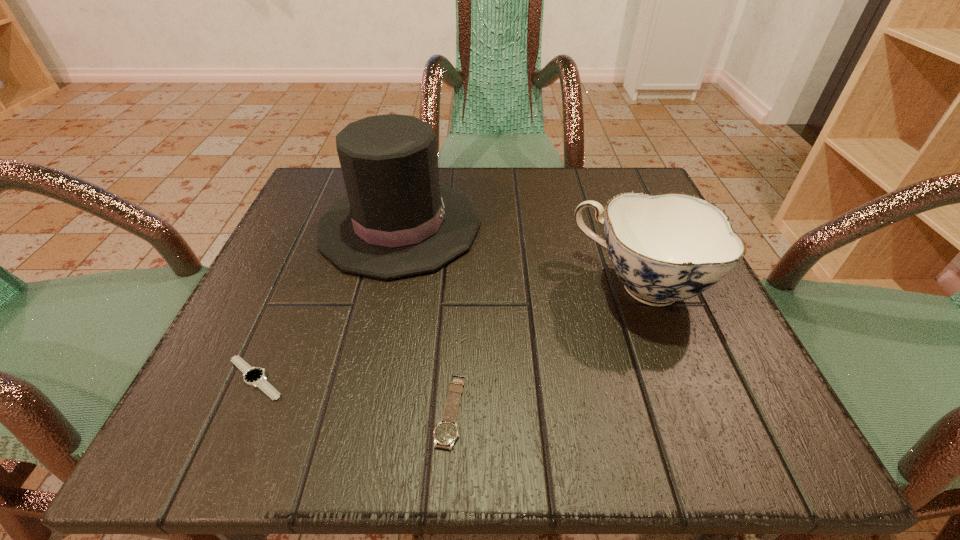
Locate an element on the screen. Image resolution: width=960 pixels, height=540 pixels. free space between the chinaware and the tallest object is located at coordinates (519, 255).

Locate an element on the screen. The width and height of the screenshot is (960, 540). free point between the right watch and the third shortest object is located at coordinates (545, 348).

You are a GUI agent. You are given a task and a screenshot of the screen. Output one action in this format:
    pyautogui.click(x=<x>, y=<y>)
    Task: Click on the free space between the left watch and the right watch
    The image size is (960, 540).
    Given the screenshot: What is the action you would take?
    pyautogui.click(x=353, y=394)

Locate which object is the second closest to the right watch. Please provide its 2D coordinates. Your answer should be formatted as a tuple, i.e. [(x, y)], where the tuple contains the x and y coordinates of a point satisfying the conditions above.

[(667, 247)]

You are a GUI agent. You are given a task and a screenshot of the screen. Output one action in this format:
    pyautogui.click(x=<x>, y=<y>)
    Task: Click on the object that can be found as the closest to the right watch
    
    Given the screenshot: What is the action you would take?
    pyautogui.click(x=397, y=220)

Locate an element on the screen. vacant point that satisfies the following two spatial constraints: 1. on the front of the right watch with the decoration; 2. on the left side of the dress hat is located at coordinates (359, 410).

Locate an element on the screen. The image size is (960, 540). vacant region that satisfies the following two spatial constraints: 1. on the front of the tallest object with the decoration; 2. on the right side of the right watch is located at coordinates (359, 410).

Find the location of a particular element. Image resolution: width=960 pixels, height=540 pixels. vacant region that satisfies the following two spatial constraints: 1. on the back side of the second tallest object; 2. on the right side of the right watch is located at coordinates (457, 285).

You are a GUI agent. You are given a task and a screenshot of the screen. Output one action in this format:
    pyautogui.click(x=<x>, y=<y>)
    Task: Click on the free space that satisfies the following two spatial constraints: 1. on the front of the right watch with the decoration; 2. on the right side of the tallest object
    Image resolution: width=960 pixels, height=540 pixels.
    Given the screenshot: What is the action you would take?
    pyautogui.click(x=359, y=410)